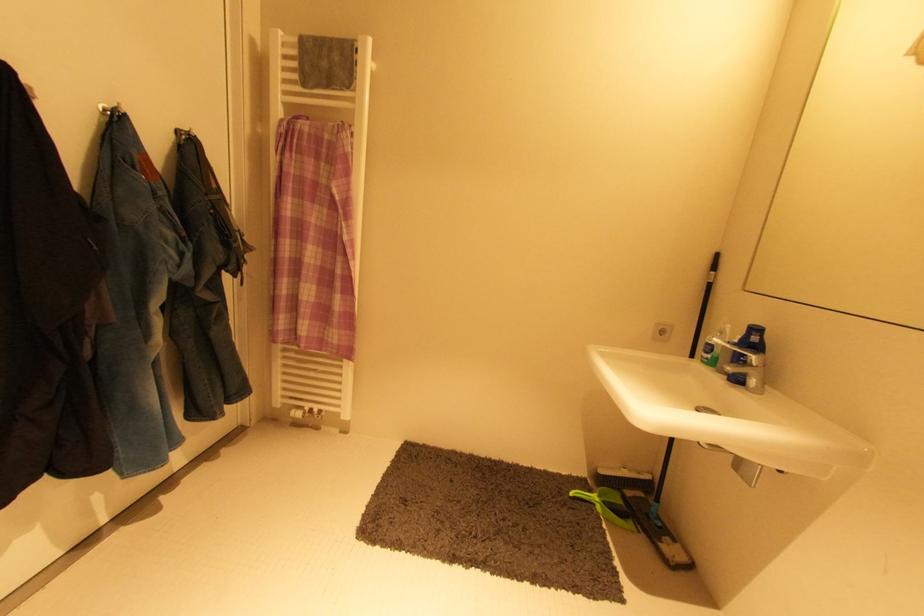
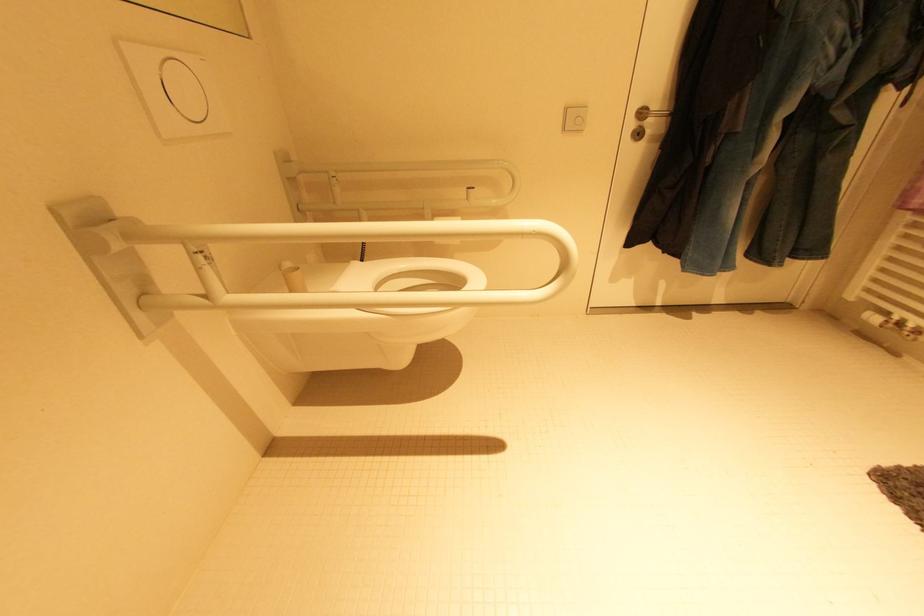
The images are taken continuously from a first-person perspective. In which direction is your viewpoint rotating?

The rotation direction of the camera is left-down.